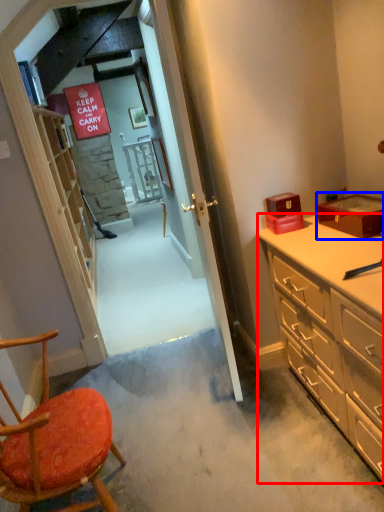
Question: Which object is further to the camera taking this photo, cabinetry (highlighted by a red box) or box (highlighted by a blue box)?

Choices:
 (A) cabinetry
 (B) box

Answer: (B)